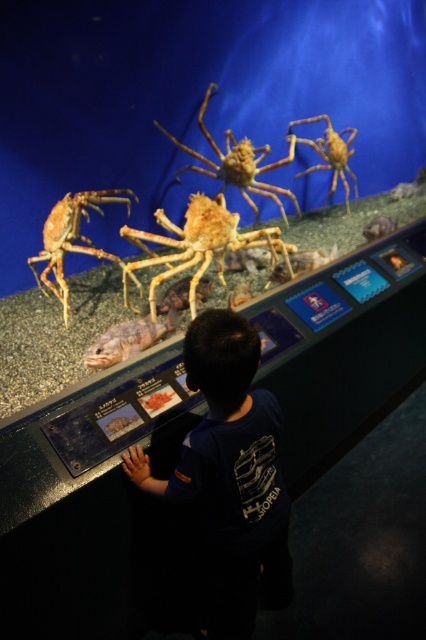
Does dark blue t-shirt at center appear on the right side of golden textured crab at center?

In fact, dark blue t-shirt at center is to the left of golden textured crab at center.

Does dark blue t-shirt at center have a lesser width compared to golden textured crab at center?

Yes, dark blue t-shirt at center is thinner than golden textured crab at center.

Between point (230, 518) and point (273, 193), which one is positioned behind?

Point (273, 193)

Where is `dark blue t-shirt at center`? The height and width of the screenshot is (640, 426). dark blue t-shirt at center is located at coordinates (230, 474).

What do you see at coordinates (230, 474) in the screenshot?
I see `dark blue t-shirt at center` at bounding box center [230, 474].

Between dark blue t-shirt at center and matte orange crab at left, which one appears on the right side from the viewer's perspective?

dark blue t-shirt at center is more to the right.

This screenshot has width=426, height=640. Find the location of `dark blue t-shirt at center`. dark blue t-shirt at center is located at coordinates (230, 474).

Which is above, golden textured crab at center or brown textured fish at center?

golden textured crab at center is above.

Which is in front, point (183, 168) or point (103, 365)?

Point (103, 365) is more forward.

This screenshot has width=426, height=640. In order to click on golden textured crab at center in this screenshot , I will do `click(238, 163)`.